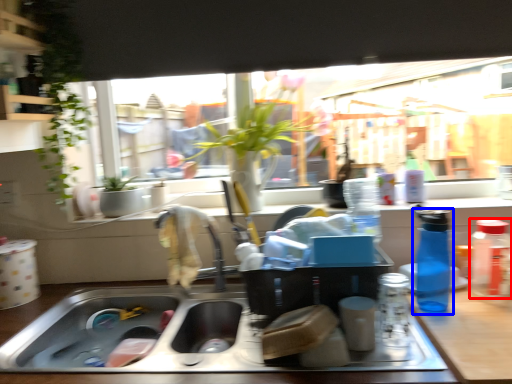
Question: Which object appears farthest to the camera in this image, bottle (highlighted by a red box) or bottle (highlighted by a blue box)?

Choices:
 (A) bottle
 (B) bottle

Answer: (A)